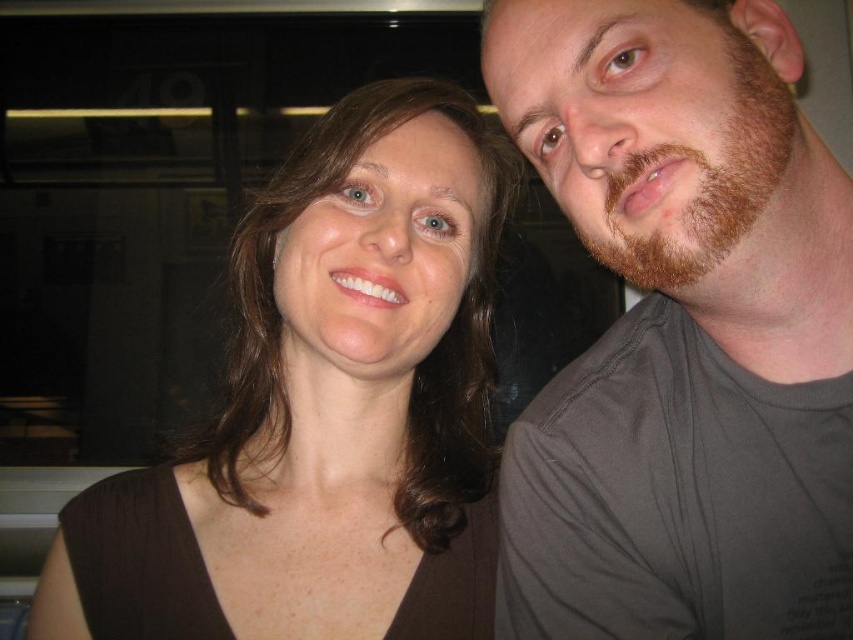
Question: Is the position of dark gray t-shirt at right less distant than that of brown fuzzy beard at right?

Choices:
 (A) yes
 (B) no

Answer: (B)

Question: Can you confirm if brown matte shirt at center is positioned to the left of brown fuzzy beard at right?

Choices:
 (A) no
 (B) yes

Answer: (B)

Question: Which of the following is the farthest from the observer?

Choices:
 (A) brown fuzzy beard at right
 (B) dark gray t-shirt at right

Answer: (B)

Question: Which object appears farthest from the camera in this image?

Choices:
 (A) brown matte shirt at center
 (B) brown fuzzy beard at right
 (C) dark gray t-shirt at right

Answer: (A)

Question: Which object appears farthest from the camera in this image?

Choices:
 (A) brown fuzzy beard at right
 (B) brown matte shirt at center
 (C) dark gray t-shirt at right

Answer: (B)

Question: Is dark gray t-shirt at right behind brown fuzzy beard at right?

Choices:
 (A) yes
 (B) no

Answer: (A)